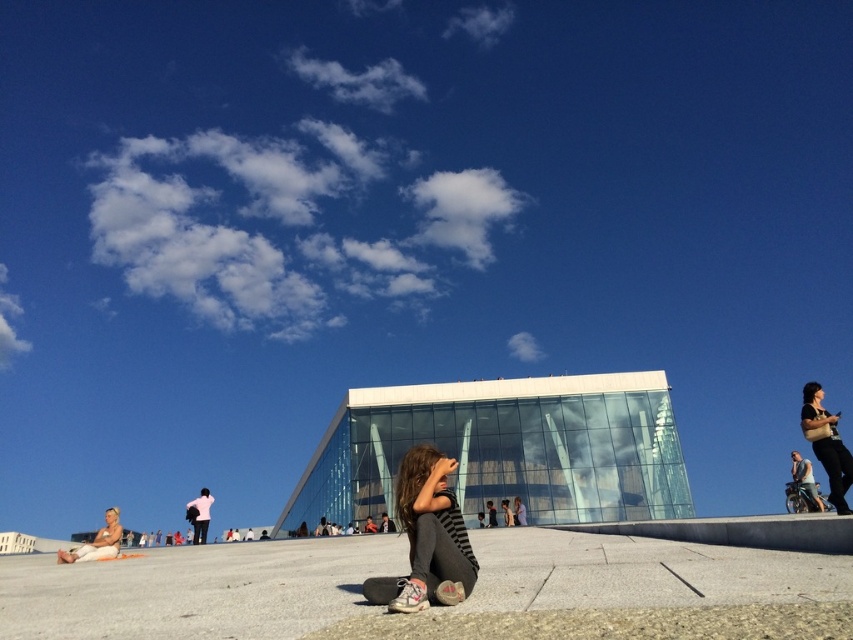
From the picture: You are organizing a photo shoot and need to know which clothing item takes up more visual space in the image. Which one is larger between the matte black shirt at right and the light brown leather jacket at lower left?

The light brown leather jacket at lower left takes up more visual space than the matte black shirt at right because the matte black shirt at right occupies less space than light brown leather jacket at lower left.

You are a photographer trying to capture a candid shot of the striped fabric girl at center and the matte black shirt at right. Based on their positions, which subject is positioned higher in the frame?

The striped fabric girl at center is located above the matte black shirt at right, so she is positioned higher in the frame.

You are a photographer wanting to capture both the matte black shirt at right and the light brown leather jacket at lower left in the same frame. Based on their positions, which one will appear closer to the top of your photo?

The matte black shirt at right is located above the light brown leather jacket at lower left, so it will appear closer to the top of the photo.